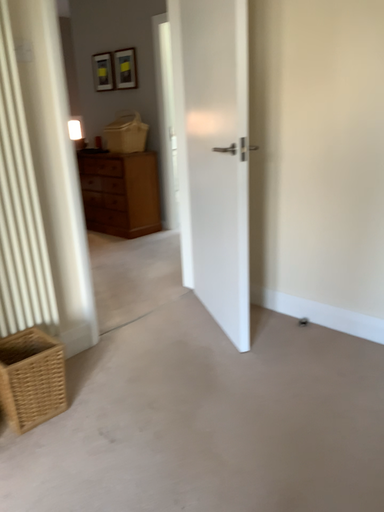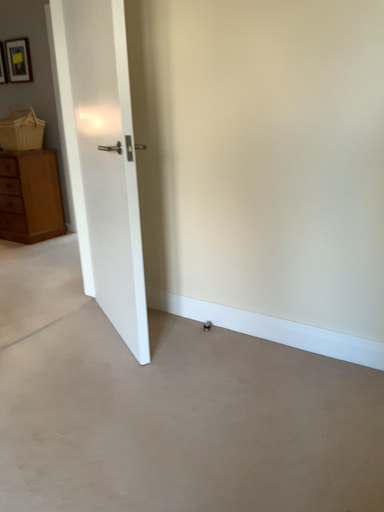
Question: How did the camera likely rotate when shooting the video?

Choices:
 (A) rotated left
 (B) rotated right

Answer: (B)